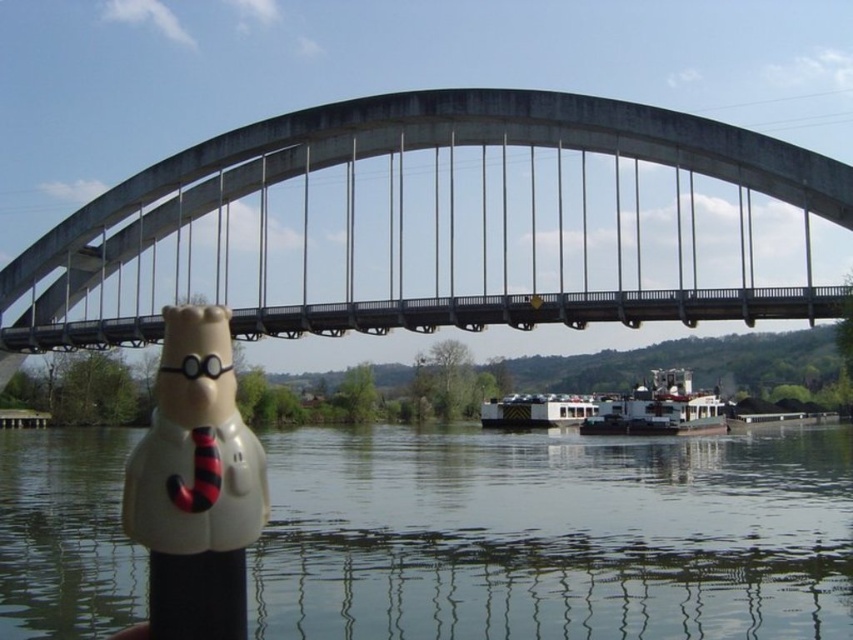
Is concrete bridge at center bigger than white matte figurine at lower left?

Indeed, concrete bridge at center has a larger size compared to white matte figurine at lower left.

What do you see at coordinates (445, 225) in the screenshot? I see `concrete bridge at center` at bounding box center [445, 225].

Where is `concrete bridge at center`? concrete bridge at center is located at coordinates (445, 225).

Is transparent plastic water at lower center taller than white matte boat at center?

Incorrect, transparent plastic water at lower center's height is not larger of white matte boat at center's.

Is transparent plastic water at lower center positioned at the back of white matte boat at center?

No, it is not.

You are a GUI agent. You are given a task and a screenshot of the screen. Output one action in this format:
    pyautogui.click(x=<x>, y=<y>)
    Task: Click on the transparent plastic water at lower center
    Image resolution: width=853 pixels, height=640 pixels.
    Given the screenshot: What is the action you would take?
    pyautogui.click(x=553, y=536)

The image size is (853, 640). Identify the location of transparent plastic water at lower center. (553, 536).

Is white matte boat at center shorter than white matte houseboat at center?

In fact, white matte boat at center may be taller than white matte houseboat at center.

Can you confirm if white matte boat at center is positioned to the right of white matte houseboat at center?

Indeed, white matte boat at center is positioned on the right side of white matte houseboat at center.

The height and width of the screenshot is (640, 853). Find the location of `white matte boat at center`. white matte boat at center is located at coordinates (659, 410).

Locate an element on the screen. The height and width of the screenshot is (640, 853). white matte boat at center is located at coordinates (659, 410).